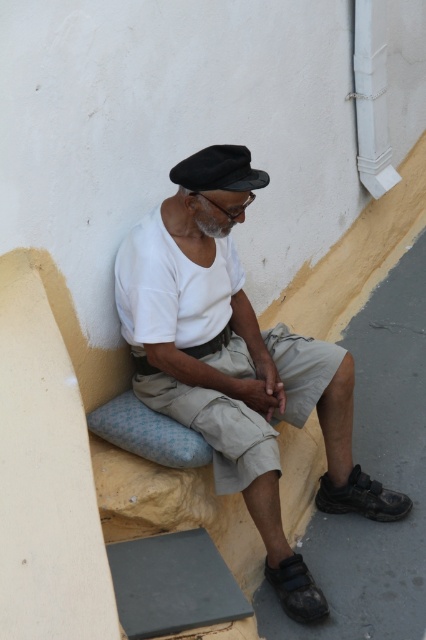
Does white cotton shirt at center appear over black felt cap at upper center?

No.

Describe the element at coordinates (238, 376) in the screenshot. I see `white cotton shirt at center` at that location.

Find the location of a particular element. white cotton shirt at center is located at coordinates (238, 376).